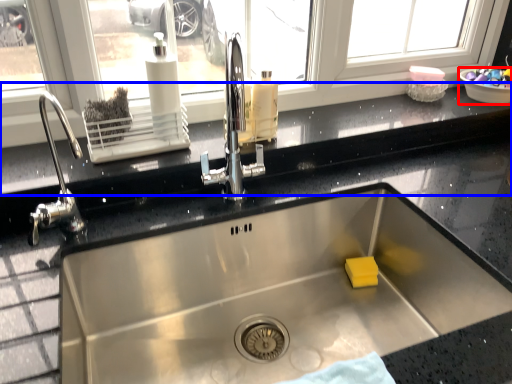
Question: Which object is further to the camera taking this photo, basin (highlighted by a red box) or window sill (highlighted by a blue box)?

Choices:
 (A) basin
 (B) window sill

Answer: (A)